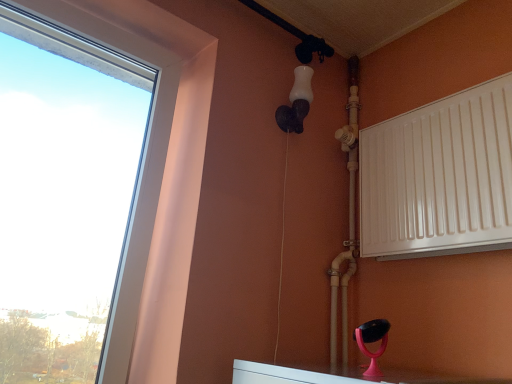
Question: From the image's perspective, relative to white matte radiator at right, is white plastic window at left above or below?

Choices:
 (A) above
 (B) below

Answer: (A)

Question: Based on their positions, is white plastic window at left located to the left or right of white matte radiator at right?

Choices:
 (A) left
 (B) right

Answer: (A)

Question: Which object is the closest to the white plastic window at left?

Choices:
 (A) white matte light fixture at upper center
 (B) white glossy pipe at upper right
 (C) white matte radiator at right

Answer: (A)

Question: Considering the real-world distances, which object is closest to the white glossy pipe at upper right?

Choices:
 (A) white matte radiator at right
 (B) white plastic window at left
 (C) white matte light fixture at upper center

Answer: (A)